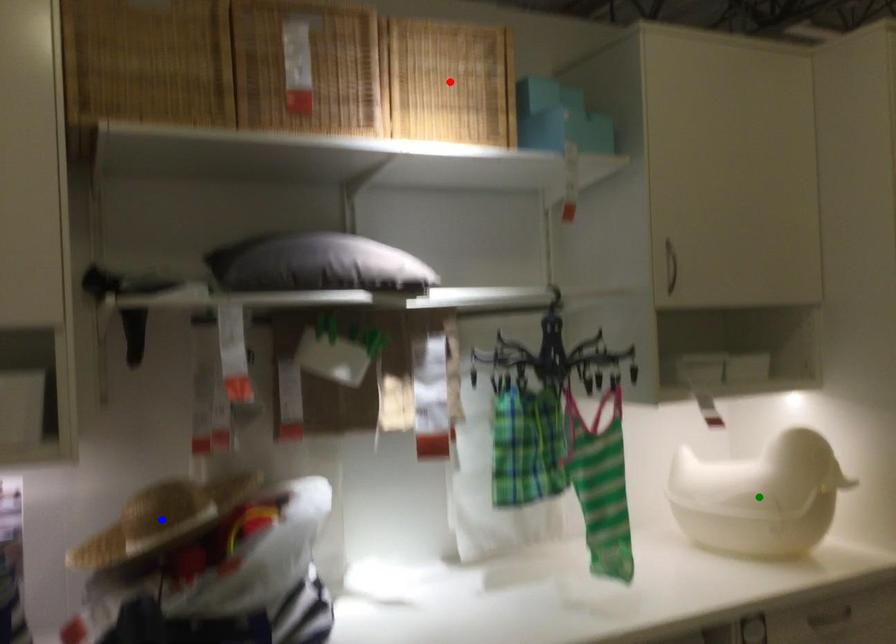
Order these from nearest to farthest:
1. blue point
2. red point
3. green point

green point, red point, blue point